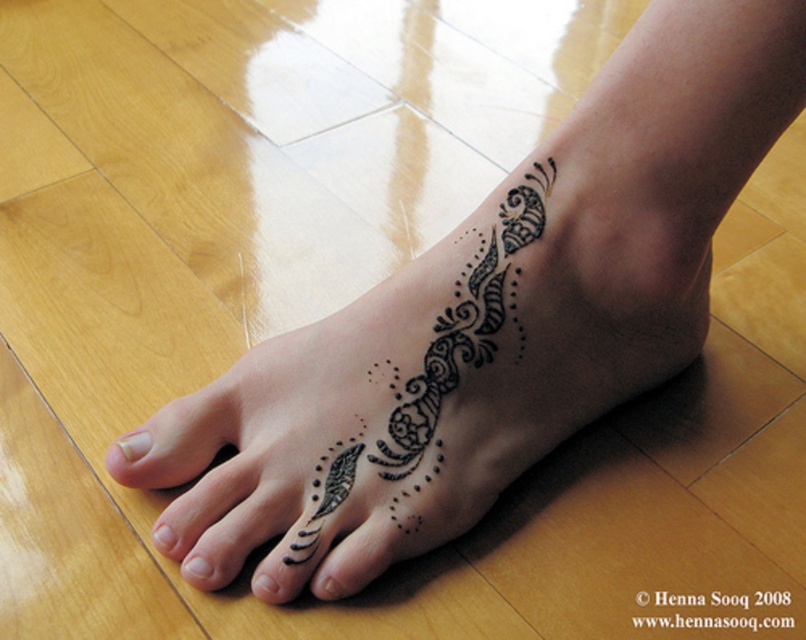
You are an artist trying to replicate the henna design on your own foot. You notice the white matte nail at lower left and the black ink dot at lower center in the reference image. Based on their positions, which object is closer to you?

The white matte nail at lower left is closer to you because the black ink dot at lower center is positioned behind it.

You are a professional photographer who needs to capture the details of the black ink tattoo at lower center and the black matte nail at lower left. Which object should you focus on if you want to capture the larger one?

The black ink tattoo at lower center is bigger than the black matte nail at lower left, so you should focus on the black ink tattoo at lower center to capture the larger one.

You are a professional photographer setting up a shoot. You need to ensure that the black ink tattoo at lower center and the white matte nail at lower left are both in focus. Given that your camera can only sharply focus on objects within a 10 inch range, will both elements be in focus if they are positioned exactly as shown?

The distance between the black ink tattoo at lower center and the white matte nail at lower left is 9.22 inches, which is within the 10 inch range. Therefore, both elements will be in focus.